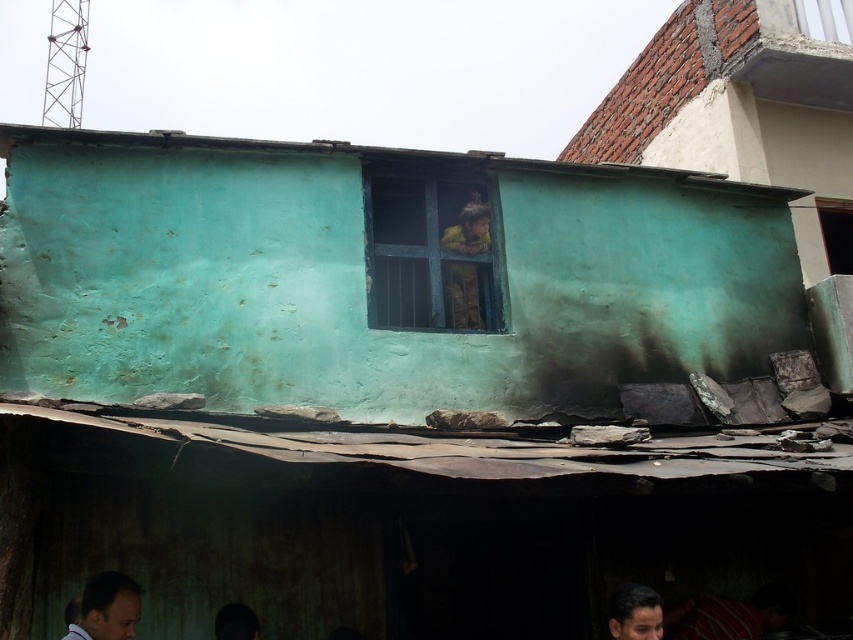
Question: Among these objects, which one is farthest from the camera?

Choices:
 (A) teal painted wall at center
 (B) dark brown hair at lower left
 (C) smooth brown hair at lower right

Answer: (A)

Question: Is dark brown hair at lower left to the left of smooth brown hair at lower right from the viewer's perspective?

Choices:
 (A) yes
 (B) no

Answer: (A)

Question: Which of the following is the closest to the observer?

Choices:
 (A) teal painted wall at center
 (B) smooth brown hair at lower right

Answer: (B)

Question: Considering the real-world distances, which object is closest to the dark brown hair at lower left?

Choices:
 (A) smooth brown hair at lower right
 (B) teal painted wall at center

Answer: (A)

Question: Does teal painted wall at center come in front of dark brown hair at lower left?

Choices:
 (A) yes
 (B) no

Answer: (B)

Question: Is the position of teal painted wall at center less distant than that of smooth brown hair at lower right?

Choices:
 (A) yes
 (B) no

Answer: (B)